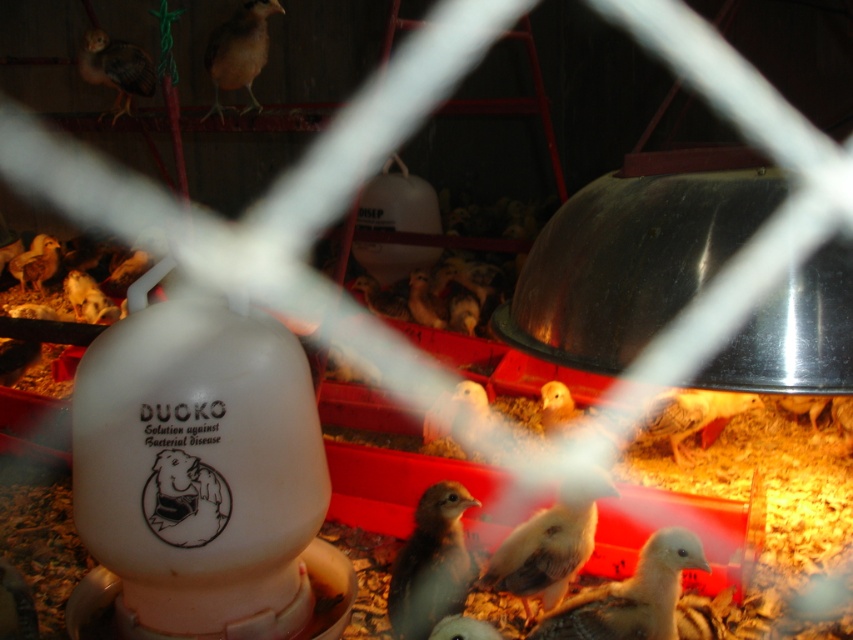
Question: Is light brown feathered chick at center to the right of brown feathered bird at upper left from the viewer's perspective?

Choices:
 (A) no
 (B) yes

Answer: (B)

Question: Which point is farther from the camera taking this photo?

Choices:
 (A) (434, 602)
 (B) (84, 36)
 (C) (595, 493)

Answer: (B)

Question: Which point appears farthest from the camera in this image?

Choices:
 (A) (399, 600)
 (B) (97, 52)

Answer: (B)

Question: Does light brown feathers at center have a larger size compared to brown feathered chick at upper left?

Choices:
 (A) yes
 (B) no

Answer: (B)

Question: Which point appears farthest from the camera in this image?

Choices:
 (A) (231, 29)
 (B) (566, 627)

Answer: (A)

Question: Does light brown feathers at center appear under brown feathered chick at upper left?

Choices:
 (A) yes
 (B) no

Answer: (A)